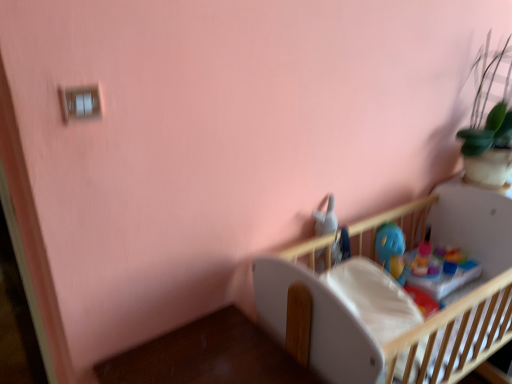
Where is `blue plastic toy at upper center`? The width and height of the screenshot is (512, 384). blue plastic toy at upper center is located at coordinates (391, 250).

At what (x,y) coordinates should I click in order to perform the action: click on white matte table at lower right. Please return your answer as a coordinate pair (x, y). Looking at the image, I should click on (207, 356).

Where is `blue plastic toy at upper center`? blue plastic toy at upper center is located at coordinates (391, 250).

Is point (246, 367) positioned behind point (438, 359)?

No, (246, 367) is in front of (438, 359).

Does white matte table at lower right have a greater width compared to wooden crib at center?

Incorrect, the width of white matte table at lower right does not surpass that of wooden crib at center.

Where is `infant bed that appears on the right of white matte table at lower right`? infant bed that appears on the right of white matte table at lower right is located at coordinates (403, 301).

From the picture: Considering the sizes of objects wooden crib at center and blue plastic toy at upper center in the image provided, who is thinner, wooden crib at center or blue plastic toy at upper center?

With smaller width is blue plastic toy at upper center.

Would you say wooden crib at center is to the left or to the right of blue plastic toy at upper center in the picture?

From the image, it's evident that wooden crib at center is to the right of blue plastic toy at upper center.

Which is closer, (466, 231) or (396, 257)?

Point (466, 231) is farther from the camera than point (396, 257).

How much distance is there between wooden crib at center and blue plastic toy at upper center?

11.96 inches.

Can you confirm if blue plastic toy at upper center is taller than white matte table at lower right?

No, blue plastic toy at upper center is not taller than white matte table at lower right.

Does point (384, 246) appear closer or farther from the camera than point (217, 315)?

Point (384, 246) is positioned farther from the camera compared to point (217, 315).

From the image's perspective, does blue plastic toy at upper center appear higher than white matte table at lower right?

Yes, from the image's perspective, blue plastic toy at upper center is over white matte table at lower right.

From the image's perspective, which one is positioned lower, white matte table at lower right or blue plastic toy at upper center?

white matte table at lower right.

From a real-world perspective, is white matte table at lower right physically located above or below blue plastic toy at upper center?

Clearly, from a real-world perspective, white matte table at lower right is below blue plastic toy at upper center.

Is white matte table at lower right outside of blue plastic toy at upper center?

Yes.

Relative to blue plastic toy at upper center, is white matte table at lower right in front or behind?

In the image, white matte table at lower right appears in front of blue plastic toy at upper center.

Is blue plastic toy at upper center with wooden crib at center?

blue plastic toy at upper center is not next to wooden crib at center, and they're not touching.

Considering the points (402, 265) and (497, 246), which point is in front, point (402, 265) or point (497, 246)?

The point (497, 246) is closer.

Considering the positions of objects blue plastic toy at upper center and wooden crib at center in the image provided, who is more to the right, blue plastic toy at upper center or wooden crib at center?

Positioned to the right is wooden crib at center.

Is blue plastic toy at upper center taller or shorter than wooden crib at center?

blue plastic toy at upper center is shorter than wooden crib at center.

Who is more distant, wooden crib at center or white matte table at lower right?

Positioned behind is wooden crib at center.

Between wooden crib at center and white matte table at lower right, which one has larger width?

Wider between the two is wooden crib at center.

Is wooden crib at center facing towards white matte table at lower right?

No, wooden crib at center does not turn towards white matte table at lower right.

Can you confirm if wooden crib at center is positioned to the left of white matte table at lower right?

Incorrect, wooden crib at center is not on the left side of white matte table at lower right.

Locate an element on the screen. infant bed that appears behind the white matte table at lower right is located at coordinates (403, 301).

At what (x,y) coordinates should I click in order to perform the action: click on infant bed in front of the blue plastic toy at upper center. Please return your answer as a coordinate pair (x, y). Looking at the image, I should click on (403, 301).

Which object lies further to the anchor point white matte table at lower right, blue plastic toy at upper center or wooden crib at center?

The object further to white matte table at lower right is blue plastic toy at upper center.

Estimate the real-world distances between objects in this image. Which object is further from wooden crib at center, white matte table at lower right or blue plastic toy at upper center?

white matte table at lower right.

Considering their positions, is blue plastic toy at upper center positioned closer to wooden crib at center than white matte table at lower right?

Among the two, blue plastic toy at upper center is located nearer to wooden crib at center.

Estimate the real-world distances between objects in this image. Which object is further from blue plastic toy at upper center, white matte table at lower right or wooden crib at center?

Among the two, white matte table at lower right is located further to blue plastic toy at upper center.

Considering their positions, is wooden crib at center positioned further to blue plastic toy at upper center than white matte table at lower right?

The object further to blue plastic toy at upper center is white matte table at lower right.

When comparing their distances from white matte table at lower right, does wooden crib at center or blue plastic toy at upper center seem further?

Among the two, blue plastic toy at upper center is located further to white matte table at lower right.

Where is `infant bed between white matte table at lower right and blue plastic toy at upper center along the z-axis`? infant bed between white matte table at lower right and blue plastic toy at upper center along the z-axis is located at coordinates (403, 301).